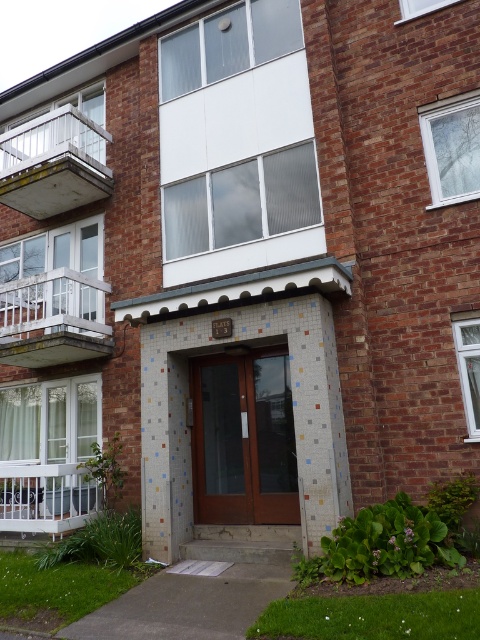
You are standing at the entrance of FLATS 13 and want to locate the metallic glass balcony at left. According to the scene description, where exactly is it positioned?

The metallic glass balcony at left is located at point (54, 163).

You are a window cleaner with a ladder that can reach up to 2 meters. You need to clean both the metallic glass balcony at left and the white painted wood balcony at lower left. Which balcony will require you to use the ladder?

The metallic glass balcony at left has a greater height compared to the white painted wood balcony at lower left, so you will need to use the ladder to reach the metallic glass balcony at left.

You are a window cleaner with a ladder that can reach up to 2 meters. You need to clean both the white glass balcony at left and the white painted wood balcony at lower left. Which balcony will require you to use the ladder?

The white glass balcony at left is much taller than the white painted wood balcony at lower left, so you will need to use the ladder for the white glass balcony at left.